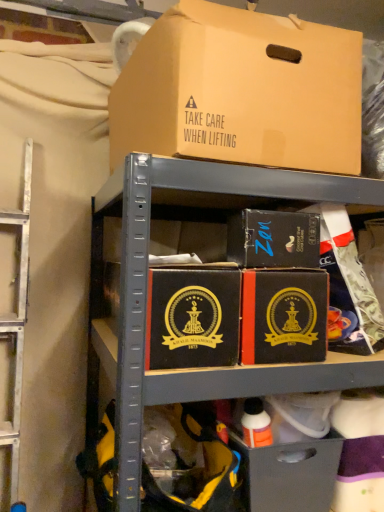
Question: Is brown cardboard box at upper center, placed as the first box when sorted from top to bottom, taller than matte black box at center, which is the 2th box from bottom to top?

Choices:
 (A) no
 (B) yes

Answer: (B)

Question: Is matte black box at center, which is the 2th box from bottom to top, a part of brown cardboard box at upper center, placed as the first box when sorted from top to bottom?

Choices:
 (A) no
 (B) yes

Answer: (A)

Question: From a real-world perspective, is brown cardboard box at upper center, placed as the first box when sorted from top to bottom, beneath matte black box at center, which is the 2th box from bottom to top?

Choices:
 (A) no
 (B) yes

Answer: (A)

Question: Could you tell me if brown cardboard box at upper center, placed as the 3th box when sorted from bottom to top, is facing matte black box at center, placed as the 2th box when sorted from top to bottom?

Choices:
 (A) no
 (B) yes

Answer: (A)

Question: Is brown cardboard box at upper center, placed as the 3th box when sorted from bottom to top, thinner than matte black box at center, which is the 2th box from bottom to top?

Choices:
 (A) no
 (B) yes

Answer: (A)

Question: Do you think matte black box at center, which is the 2th box from bottom to top, is within matte black drawer at lower center, or outside of it?

Choices:
 (A) outside
 (B) inside

Answer: (A)

Question: From the image's perspective, is matte black box at center, placed as the 2th box when sorted from top to bottom, located above or below matte black drawer at lower center?

Choices:
 (A) below
 (B) above

Answer: (B)

Question: Does point (269, 216) appear closer or farther from the camera than point (243, 494)?

Choices:
 (A) farther
 (B) closer

Answer: (B)

Question: Is matte black box at center, placed as the 2th box when sorted from top to bottom, wider or thinner than matte black drawer at lower center?

Choices:
 (A) wide
 (B) thin

Answer: (B)

Question: In terms of size, does matte black box at center, placed as the 2th box when sorted from top to bottom, appear bigger or smaller than black matte box at center, the 1th box from the bottom?

Choices:
 (A) big
 (B) small

Answer: (B)

Question: In the image, is matte black box at center, which is the 2th box from bottom to top, positioned in front of or behind black matte box at center, which is the 3th box in top-to-bottom order?

Choices:
 (A) front
 (B) behind

Answer: (B)

Question: In the image, is matte black box at center, which is the 2th box from bottom to top, on the left side or the right side of black matte box at center, which is the 3th box in top-to-bottom order?

Choices:
 (A) left
 (B) right

Answer: (B)

Question: From a real-world perspective, is matte black box at center, which is the 2th box from bottom to top, physically located above or below black matte box at center, which is the 3th box in top-to-bottom order?

Choices:
 (A) above
 (B) below

Answer: (A)

Question: In terms of width, does black matte box at center, the 1th box from the bottom, look wider or thinner when compared to matte black box at center, placed as the 2th box when sorted from top to bottom?

Choices:
 (A) thin
 (B) wide

Answer: (B)

Question: From a real-world perspective, is black matte box at center, the 1th box from the bottom, above or below matte black box at center, which is the 2th box from bottom to top?

Choices:
 (A) above
 (B) below

Answer: (B)